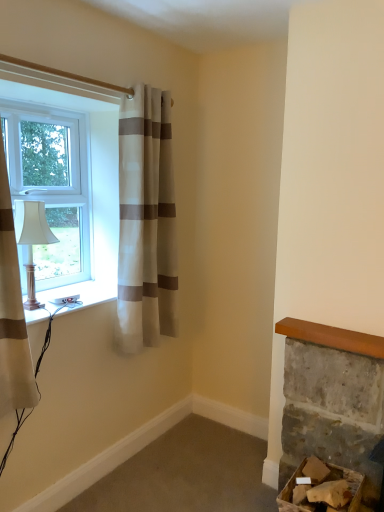
The image size is (384, 512). Describe the element at coordinates (70, 295) in the screenshot. I see `white plastic socket at lower left` at that location.

At what (x,y) coordinates should I click in order to perform the action: click on cardboard box at lower right. Please return your answer as a coordinate pair (x, y). The width and height of the screenshot is (384, 512). Looking at the image, I should click on [x=292, y=496].

This screenshot has height=512, width=384. Find the location of `white plastic window at left`. white plastic window at left is located at coordinates (66, 183).

What is the approximate width of white striped curtain at left, which is the first curtain from front to back?

It is 8.97 inches.

What do you see at coordinates (12, 313) in the screenshot?
I see `white striped curtain at left, which is the first curtain from left to right` at bounding box center [12, 313].

Where is `matte white lamp at left`? The width and height of the screenshot is (384, 512). matte white lamp at left is located at coordinates (32, 240).

Can cardboard box at lower right be found inside white plastic socket at lower left?

Definitely not — cardboard box at lower right is not inside white plastic socket at lower left.

Would you say white plastic socket at lower left is a long distance from cardboard box at lower right?

Yes, white plastic socket at lower left and cardboard box at lower right are quite far apart.

Which of these two, white plastic socket at lower left or cardboard box at lower right, stands taller?

Standing taller between the two is cardboard box at lower right.

From a real-world perspective, which object rests below the other?

In real-world perspective, cardboard box at lower right is lower.

Is rough stone fireplace at lower right smaller than white striped curtain at upper left, acting as the first curtain starting from the right?

Indeed, rough stone fireplace at lower right has a smaller size compared to white striped curtain at upper left, acting as the first curtain starting from the right.

Does point (334, 428) come closer to viewer compared to point (156, 271)?

Yes, point (334, 428) is in front of point (156, 271).

Considering the relative sizes of rough stone fireplace at lower right and white striped curtain at upper left, the first curtain viewed from the back, in the image provided, is rough stone fireplace at lower right thinner than white striped curtain at upper left, the first curtain viewed from the back,?

Indeed, rough stone fireplace at lower right has a lesser width compared to white striped curtain at upper left, the first curtain viewed from the back.

Is rough stone fireplace at lower right oriented towards white striped curtain at upper left, acting as the first curtain starting from the right?

No, rough stone fireplace at lower right is not oriented towards white striped curtain at upper left, acting as the first curtain starting from the right.

I want to click on furniture located underneath the white plastic window at left (from a real-world perspective), so click(x=292, y=496).

Considering the relative sizes of cardboard box at lower right and white plastic window at left in the image provided, is cardboard box at lower right thinner than white plastic window at left?

No, cardboard box at lower right is not thinner than white plastic window at left.

Is cardboard box at lower right in front of or behind white plastic window at left in the image?

Visually, cardboard box at lower right is located in front of white plastic window at left.

Between white plastic socket at lower left and white plastic window at left, which one has less height?

white plastic socket at lower left.

Is white plastic socket at lower left positioned before white plastic window at left?

Yes.

Is white plastic socket at lower left looking in the opposite direction of white plastic window at left?

white plastic socket at lower left is not turned away from white plastic window at left.

Is white plastic socket at lower left at the right side of white plastic window at left?

Correct, you'll find white plastic socket at lower left to the right of white plastic window at left.

Is rough stone fireplace at lower right in contact with white plastic socket at lower left?

rough stone fireplace at lower right and white plastic socket at lower left are clearly separated.

How far apart are rough stone fireplace at lower right and white plastic socket at lower left?

rough stone fireplace at lower right is 1.23 meters away from white plastic socket at lower left.

From the image's perspective, is rough stone fireplace at lower right positioned above or below white plastic socket at lower left?

From the image's perspective, rough stone fireplace at lower right appears below white plastic socket at lower left.

Is white plastic socket at lower left at the back of white striped curtain at upper left, acting as the second curtain starting from the left?

No.

Locate an element on the screen. curtain on the right of white plastic socket at lower left is located at coordinates (146, 222).

Looking at the image, does white striped curtain at upper left, acting as the first curtain starting from the right, seem bigger or smaller compared to white plastic socket at lower left?

Clearly, white striped curtain at upper left, acting as the first curtain starting from the right, is larger in size than white plastic socket at lower left.

Can we say cardboard box at lower right lies outside white plastic socket at lower left?

cardboard box at lower right lies outside white plastic socket at lower left's area.

Considering the relative sizes of cardboard box at lower right and white plastic socket at lower left in the image provided, is cardboard box at lower right shorter than white plastic socket at lower left?

Incorrect, the height of cardboard box at lower right does not fall short of that of white plastic socket at lower left.

How many degrees apart are the facing directions of cardboard box at lower right and white plastic socket at lower left?

The angle between the facing direction of cardboard box at lower right and the facing direction of white plastic socket at lower left is 90.1 degrees.

Considering the positions of objects cardboard box at lower right and white plastic socket at lower left in the image provided, who is more to the left, cardboard box at lower right or white plastic socket at lower left?

From the viewer's perspective, white plastic socket at lower left appears more on the left side.

In the image, there is a cardboard box at lower right. Identify the location of window sill above it (from the image's perspective). This screenshot has height=512, width=384. (70, 295).

I want to click on the 1st curtain to the left when counting from the rough stone fireplace at lower right, so click(146, 222).

Which object lies nearer to the anchor point matte white lamp at left, rough stone fireplace at lower right or white plastic window at left?

white plastic window at left lies closer to matte white lamp at left than the other object.

Estimate the real-world distances between objects in this image. Which object is closer to matte white lamp at left, cardboard box at lower right or white striped curtain at upper left, the first curtain viewed from the back?

white striped curtain at upper left, the first curtain viewed from the back, is positioned closer to the anchor matte white lamp at left.

Which object lies further to the anchor point white plastic window at left, white striped curtain at upper left, acting as the second curtain starting from the left, or cardboard box at lower right?

The object further to white plastic window at left is cardboard box at lower right.

Looking at the image, which one is located closer to white striped curtain at left, the 2th curtain viewed from the right, cardboard box at lower right or matte white lamp at left?

Based on the image, matte white lamp at left appears to be nearer to white striped curtain at left, the 2th curtain viewed from the right.

When comparing their distances from rough stone fireplace at lower right, does matte white lamp at left or white striped curtain at upper left, acting as the second curtain starting from the left, seem closer?

Among the two, white striped curtain at upper left, acting as the second curtain starting from the left, is located nearer to rough stone fireplace at lower right.

From the image, which object appears to be farther from white striped curtain at upper left, the first curtain viewed from the back, white plastic window at left or white plastic socket at lower left?

The object further to white striped curtain at upper left, the first curtain viewed from the back, is white plastic socket at lower left.

Looking at the image, which one is located closer to white striped curtain at left, the 2th curtain viewed from the right, white striped curtain at upper left, acting as the second curtain starting from the left, or white plastic socket at lower left?

white plastic socket at lower left is positioned closer to the anchor white striped curtain at left, the 2th curtain viewed from the right.

Estimate the real-world distances between objects in this image. Which object is further from white plastic window at left, white plastic socket at lower left or white striped curtain at upper left, marked as the second curtain in a front-to-back arrangement?

white plastic socket at lower left lies further to white plastic window at left than the other object.

Locate an element on the screen. The width and height of the screenshot is (384, 512). furniture between white plastic socket at lower left and rough stone fireplace at lower right is located at coordinates (292, 496).

Where is `window sill between white plastic window at left and rough stone fireplace at lower right`? The image size is (384, 512). window sill between white plastic window at left and rough stone fireplace at lower right is located at coordinates (70, 295).

Where is `window sill between white striped curtain at left, the 2th curtain viewed from the right, and white striped curtain at upper left, acting as the first curtain starting from the right, in the front-back direction`? window sill between white striped curtain at left, the 2th curtain viewed from the right, and white striped curtain at upper left, acting as the first curtain starting from the right, in the front-back direction is located at coordinates pyautogui.click(x=70, y=295).

Image resolution: width=384 pixels, height=512 pixels. Identify the location of lamp between white striped curtain at left, which is the first curtain from front to back, and white plastic window at left in the front-back direction. (32, 240).